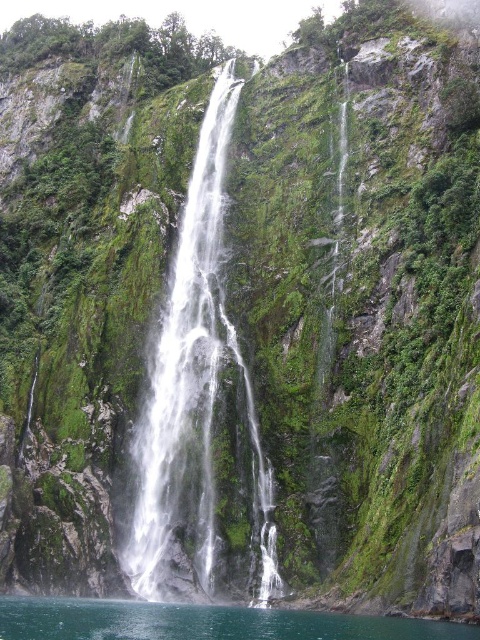
You are a photographer planning to capture the white glossy waterfall at center and the clear water at lower center in a single shot. Which of these two water features should you focus on first to ensure both are in the frame?

You should focus on the white glossy waterfall at center first because it is larger in size than the clear water at lower center, so it will occupy more of the frame and ensure both are captured effectively.